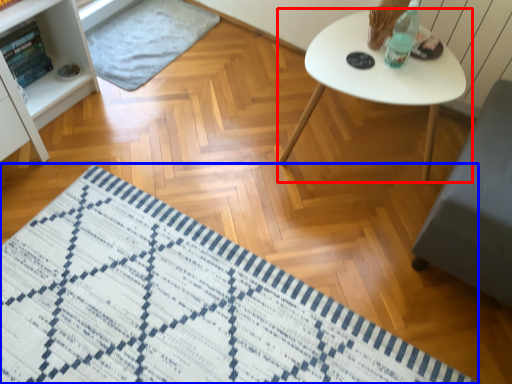
Question: Which object is further to the camera taking this photo, table (highlighted by a red box) or mat (highlighted by a blue box)?

Choices:
 (A) table
 (B) mat

Answer: (A)